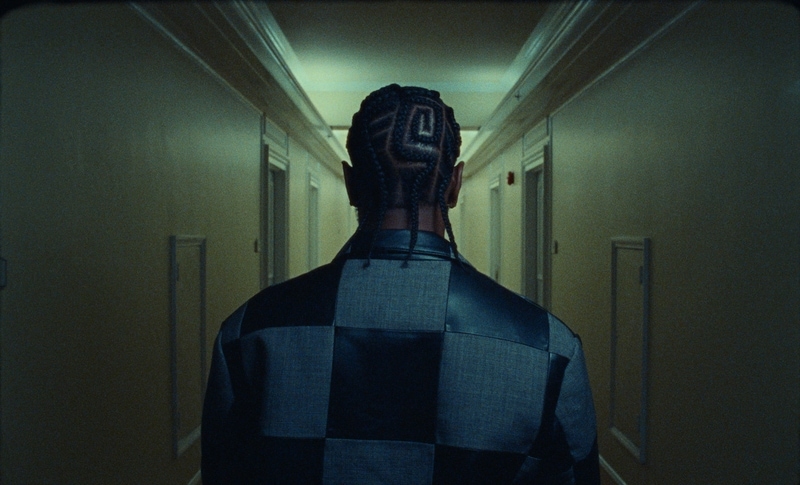
I want to click on rectangle frame on wall, so click(196, 295), click(630, 305).